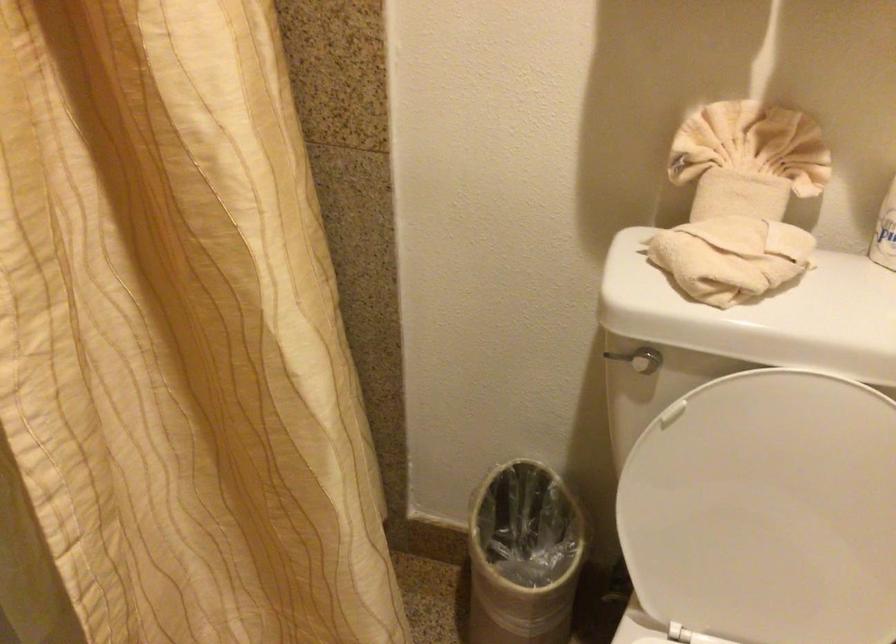
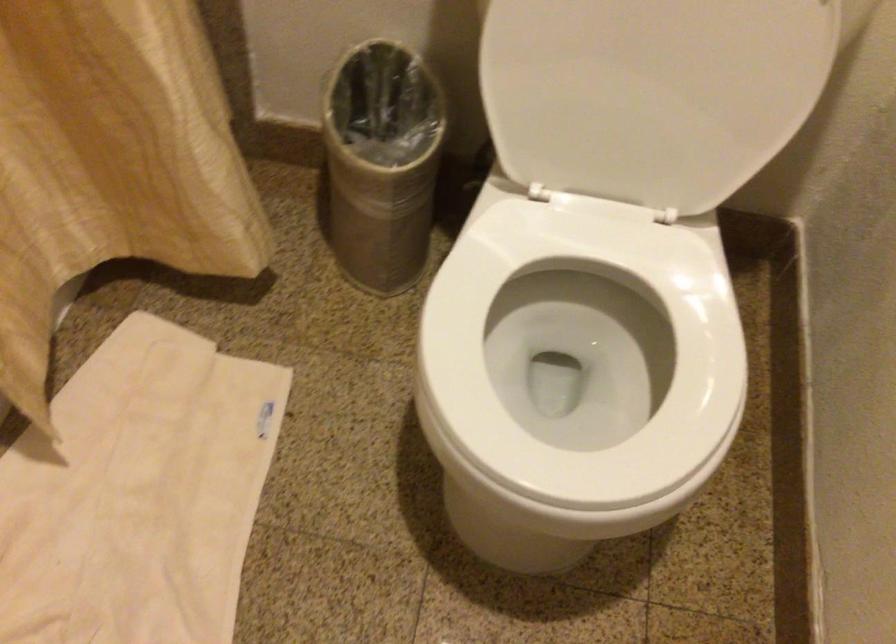
Question: What movement of the cameraman would produce the second image?

Choices:
 (A) Left
 (B) Right
 (C) Forward
 (D) Backward

Answer: (C)